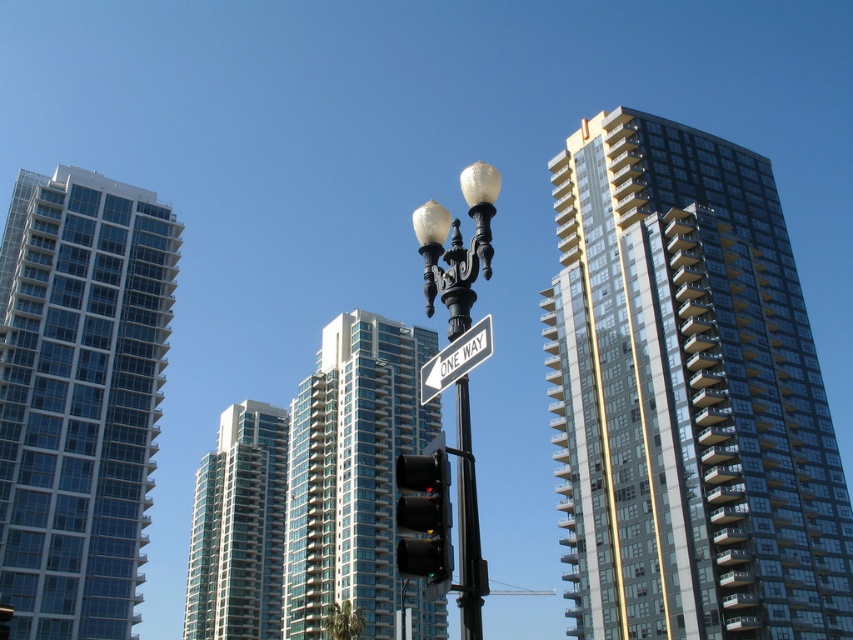
Describe the element at coordinates (351, 468) in the screenshot. I see `glassy steel building at center` at that location.

Where is `glassy steel building at center`? The image size is (853, 640). glassy steel building at center is located at coordinates (351, 468).

Can you confirm if clear glass building at left is taller than matte black street light at center?

Correct, clear glass building at left is much taller as matte black street light at center.

Looking at this image, does clear glass building at left have a lesser width compared to matte black street light at center?

No.

Between point (105, 554) and point (459, 525), which one is positioned behind?

The point (105, 554) is behind.

Find the location of `clear glass building at left`. clear glass building at left is located at coordinates (79, 396).

Is matte black street light at center taller than white plastic street sign at center?

Yes.

Is matte black street light at center smaller than white plastic street sign at center?

Indeed, matte black street light at center has a smaller size compared to white plastic street sign at center.

Where is `matte black street light at center`? This screenshot has height=640, width=853. matte black street light at center is located at coordinates (457, 244).